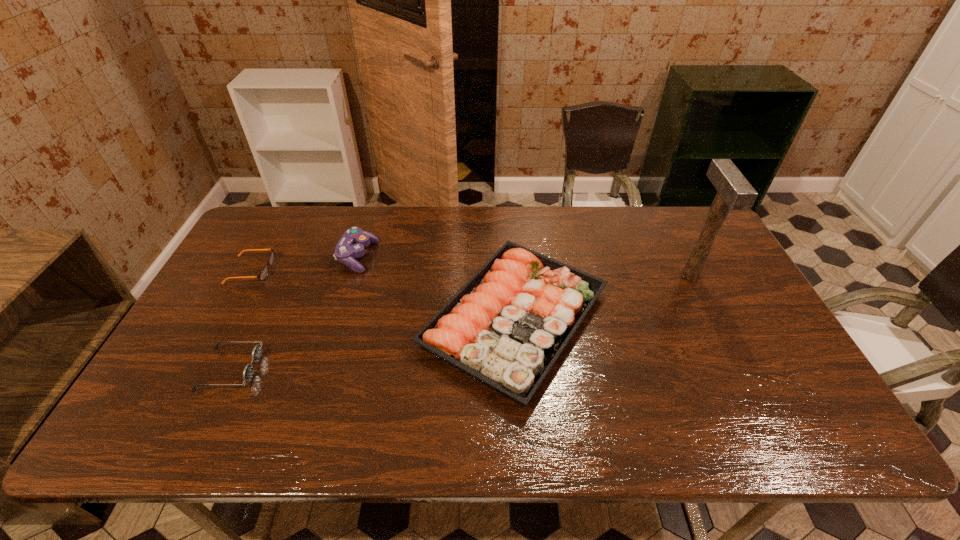
Where is `vacant space positioned on the front-facing side of the sunglasses`? The image size is (960, 540). vacant space positioned on the front-facing side of the sunglasses is located at coordinates (405, 369).

Locate an element on the screen. free space located 0.140m on the front-facing side of the shortest object is located at coordinates (317, 270).

Identify the location of object at the far edge. (351, 245).

This screenshot has width=960, height=540. I want to click on object that is at the near edge, so [x=506, y=327].

The width and height of the screenshot is (960, 540). What are the coordinates of `sunglasses at the left edge` in the screenshot? It's located at (248, 371).

Locate an element on the screen. The image size is (960, 540). spectacles situated at the left edge is located at coordinates (265, 271).

The height and width of the screenshot is (540, 960). Find the location of `object positioned at the right edge`. object positioned at the right edge is located at coordinates (734, 192).

Identify the location of vacant space at the far edge. This screenshot has height=540, width=960. (646, 219).

Locate an element on the screen. vacant space at the near edge is located at coordinates (341, 424).

In the image, there is a desktop. Where is `free space at the left edge`? free space at the left edge is located at coordinates (215, 284).